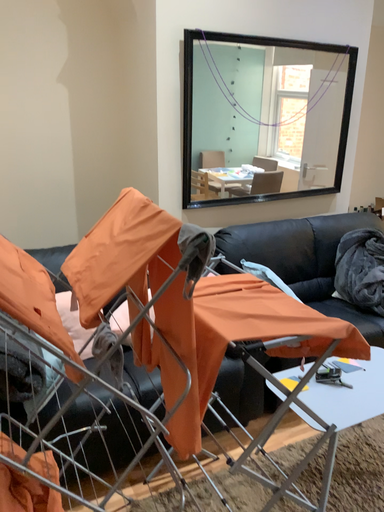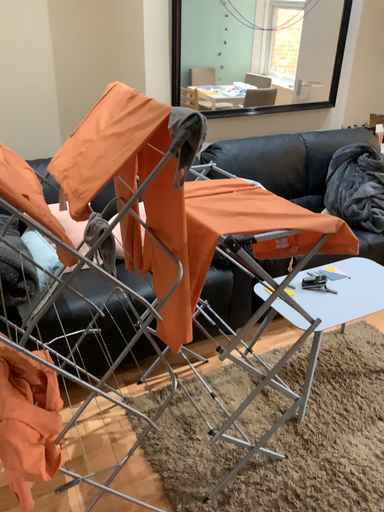
Question: Which way did the camera rotate in the video?

Choices:
 (A) rotated downward
 (B) rotated upward

Answer: (A)